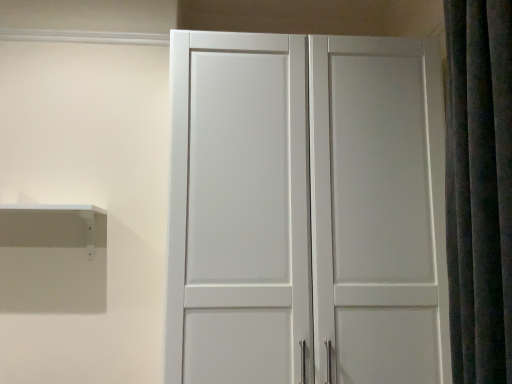
Question: Considering the positions of dark gray velvet shower curtain at right and white matte shelf at left in the image, is dark gray velvet shower curtain at right wider or thinner than white matte shelf at left?

Choices:
 (A) wide
 (B) thin

Answer: (A)

Question: Relative to white matte shelf at left, is dark gray velvet shower curtain at right in front or behind?

Choices:
 (A) front
 (B) behind

Answer: (A)

Question: Considering the positions of point (473, 365) and point (4, 215), is point (473, 365) closer or farther from the camera than point (4, 215)?

Choices:
 (A) closer
 (B) farther

Answer: (A)

Question: Considering the positions of white matte shelf at left and dark gray velvet shower curtain at right in the image, is white matte shelf at left bigger or smaller than dark gray velvet shower curtain at right?

Choices:
 (A) big
 (B) small

Answer: (B)

Question: Is point (62, 240) positioned closer to the camera than point (464, 215)?

Choices:
 (A) farther
 (B) closer

Answer: (A)

Question: Is white matte shelf at left wider or thinner than dark gray velvet shower curtain at right?

Choices:
 (A) thin
 (B) wide

Answer: (A)

Question: Choose the correct answer: Is white matte shelf at left inside dark gray velvet shower curtain at right or outside it?

Choices:
 (A) outside
 (B) inside

Answer: (A)